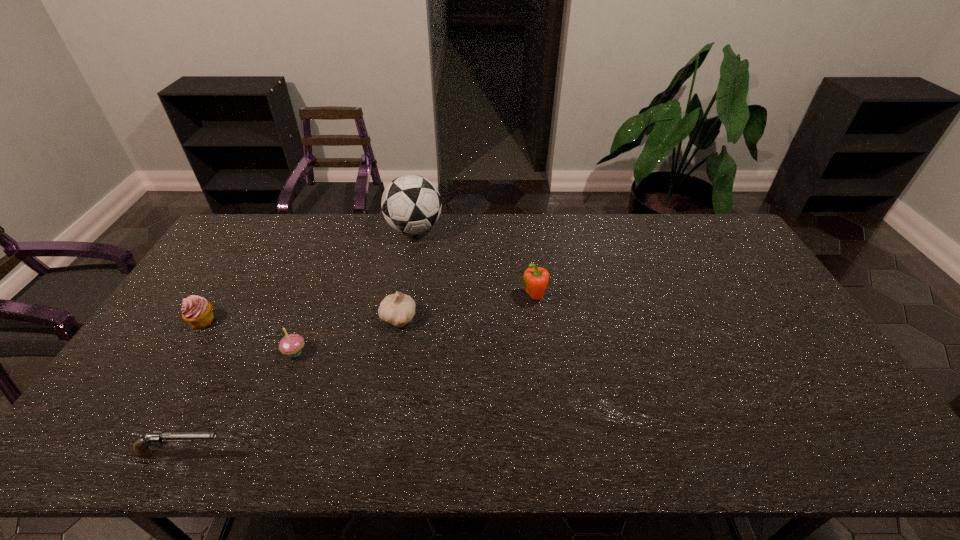
I want to click on free space that satisfies the following two spatial constraints: 1. on the back side of the left cupcake; 2. on the left side of the garlic, so click(x=204, y=319).

Image resolution: width=960 pixels, height=540 pixels. Find the location of `free point that satisfies the following two spatial constraints: 1. on the surface of the soccer ball where the brand logo is visible; 2. on the back side of the garlic`. free point that satisfies the following two spatial constraints: 1. on the surface of the soccer ball where the brand logo is visible; 2. on the back side of the garlic is located at coordinates (397, 319).

Locate an element on the screen. The width and height of the screenshot is (960, 540). vacant space that satisfies the following two spatial constraints: 1. on the back side of the leftmost object; 2. on the right side of the rightmost object is located at coordinates (217, 298).

This screenshot has height=540, width=960. I want to click on free space that satisfies the following two spatial constraints: 1. on the back side of the fifth shortest object; 2. on the surface of the tallest object where the brand logo is visible, so click(x=526, y=229).